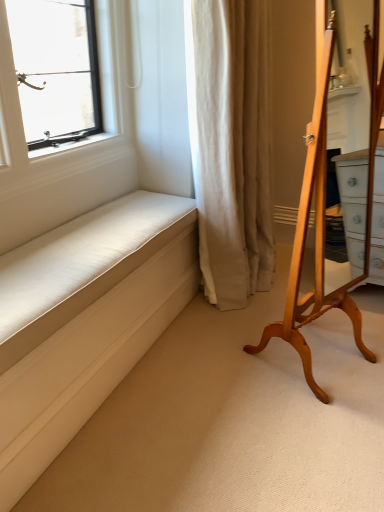
Question: Is white fabric cushion at lower left at the right side of beige fabric curtain at center?

Choices:
 (A) yes
 (B) no

Answer: (B)

Question: Considering the relative sizes of white fabric cushion at lower left and beige fabric curtain at center in the image provided, is white fabric cushion at lower left bigger than beige fabric curtain at center?

Choices:
 (A) yes
 (B) no

Answer: (B)

Question: Considering the relative positions of white fabric cushion at lower left and beige fabric curtain at center in the image provided, is white fabric cushion at lower left in front of beige fabric curtain at center?

Choices:
 (A) yes
 (B) no

Answer: (A)

Question: Considering the relative sizes of white fabric cushion at lower left and beige fabric curtain at center in the image provided, is white fabric cushion at lower left thinner than beige fabric curtain at center?

Choices:
 (A) yes
 (B) no

Answer: (A)

Question: From a real-world perspective, is white fabric cushion at lower left over beige fabric curtain at center?

Choices:
 (A) yes
 (B) no

Answer: (B)

Question: From a real-world perspective, is white fabric cushion at lower left located beneath beige fabric curtain at center?

Choices:
 (A) no
 (B) yes

Answer: (B)

Question: Is white fabric cushion at lower left outside light brown wooden mirror at right?

Choices:
 (A) no
 (B) yes

Answer: (B)

Question: Does white fabric cushion at lower left come behind light brown wooden mirror at right?

Choices:
 (A) yes
 (B) no

Answer: (B)

Question: Does white fabric cushion at lower left touch light brown wooden mirror at right?

Choices:
 (A) yes
 (B) no

Answer: (B)

Question: Does white fabric cushion at lower left appear on the left side of light brown wooden mirror at right?

Choices:
 (A) no
 (B) yes

Answer: (B)

Question: Are white fabric cushion at lower left and light brown wooden mirror at right far apart?

Choices:
 (A) yes
 (B) no

Answer: (B)

Question: Does white fabric cushion at lower left have a lesser width compared to light brown wooden mirror at right?

Choices:
 (A) yes
 (B) no

Answer: (A)

Question: Is beige fabric curtain at center located outside light brown wooden mirror at right?

Choices:
 (A) no
 (B) yes

Answer: (B)